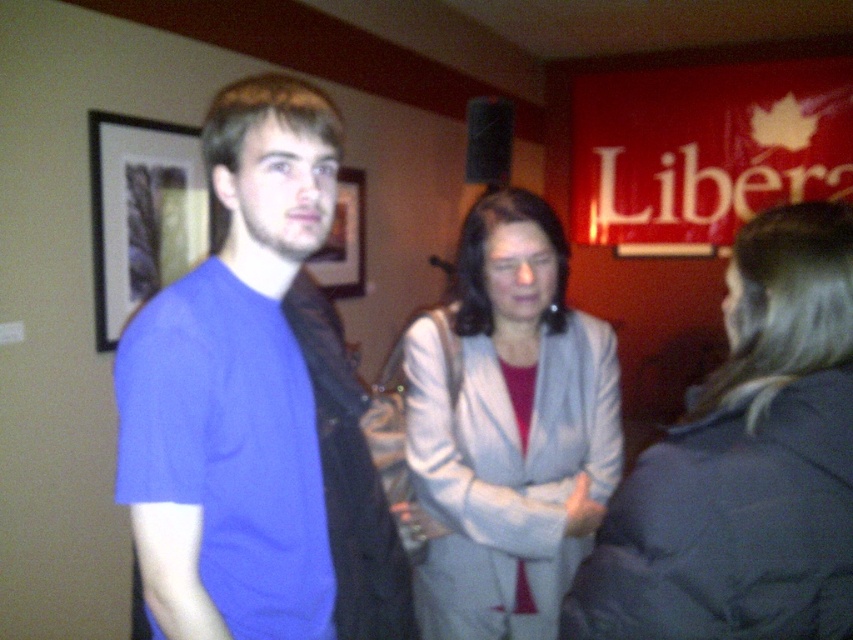
Question: Is light gray fabric coat at center in front of light gray fabric jacket at center?

Choices:
 (A) yes
 (B) no

Answer: (A)

Question: Which of the following is the closest to the observer?

Choices:
 (A) (138, 163)
 (B) (784, 465)
 (C) (347, 253)

Answer: (B)

Question: Which object is positioned farthest from the light gray fabric jacket at center?

Choices:
 (A) light gray fabric coat at center
 (B) black framed picture at left
 (C) matte blue t-shirt at center
 (D) matte plastic picture frame at center

Answer: (D)

Question: Is light gray fabric jacket at center positioned before matte plastic picture frame at center?

Choices:
 (A) yes
 (B) no

Answer: (A)

Question: Is matte blue t-shirt at center smaller than light gray fabric jacket at center?

Choices:
 (A) yes
 (B) no

Answer: (A)

Question: Which object appears farthest from the camera in this image?

Choices:
 (A) black framed picture at left
 (B) matte blue t-shirt at center
 (C) matte plastic picture frame at center
 (D) light gray fabric jacket at center

Answer: (C)